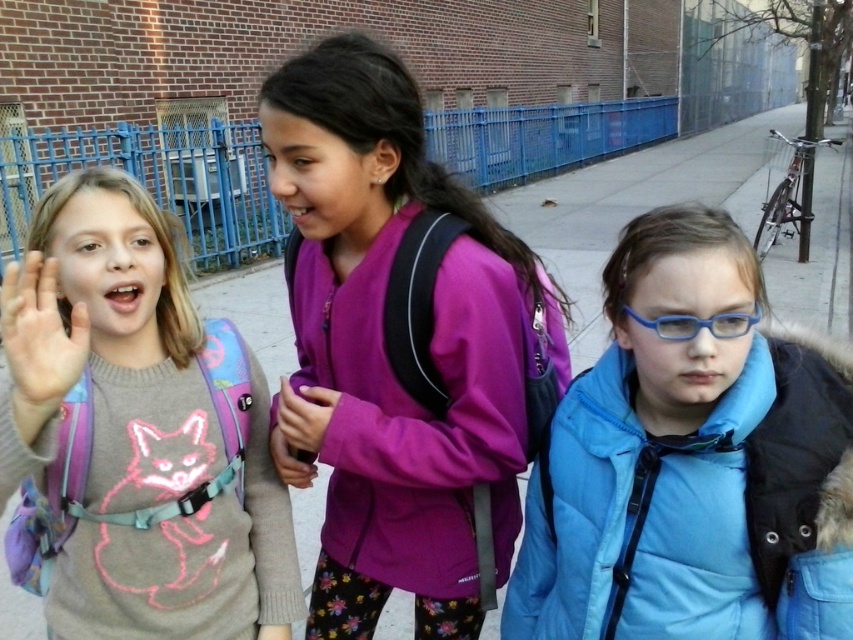
You are a photographer trying to capture a candid shot of the blue matte jacket at center and the smooth skin hand at center left. Which object should you focus on first if you want to ensure both are in focus?

The smooth skin hand at center left should be focused on first because it is closer to the camera than the blue matte jacket at center, which is further away. By focusing on the closer object, the background object will also be in focus.

You are a fashion designer observing the two jackets in the image. Which jacket, the purple fleece jacket at center or the blue matte jacket at center, has a greater height measurement?

The purple fleece jacket at center is taller than the blue matte jacket at center according to the description.